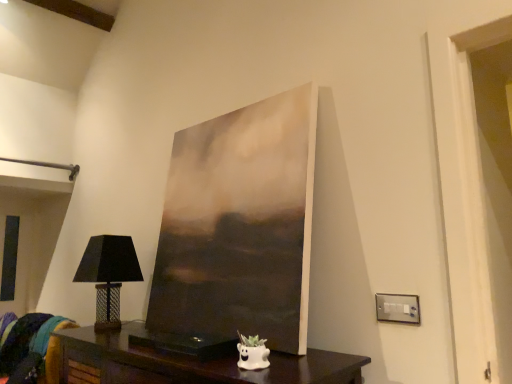
Question: In terms of width, does dark wood table at lower center look wider or thinner when compared to satin silver switchplate at lower right?

Choices:
 (A) thin
 (B) wide

Answer: (B)

Question: Is dark wood table at lower center inside the boundaries of satin silver switchplate at lower right, or outside?

Choices:
 (A) inside
 (B) outside

Answer: (B)

Question: Considering the real-world distances, which object is farthest from the dark wood table at lower center?

Choices:
 (A) velvet teal cushion at lower left
 (B) matte black lampshade at left
 (C) satin silver switchplate at lower right

Answer: (C)

Question: Which object is positioned closest to the matte black lampshade at left?

Choices:
 (A) velvet teal cushion at lower left
 (B) dark wood table at lower center
 (C) satin silver switchplate at lower right

Answer: (A)